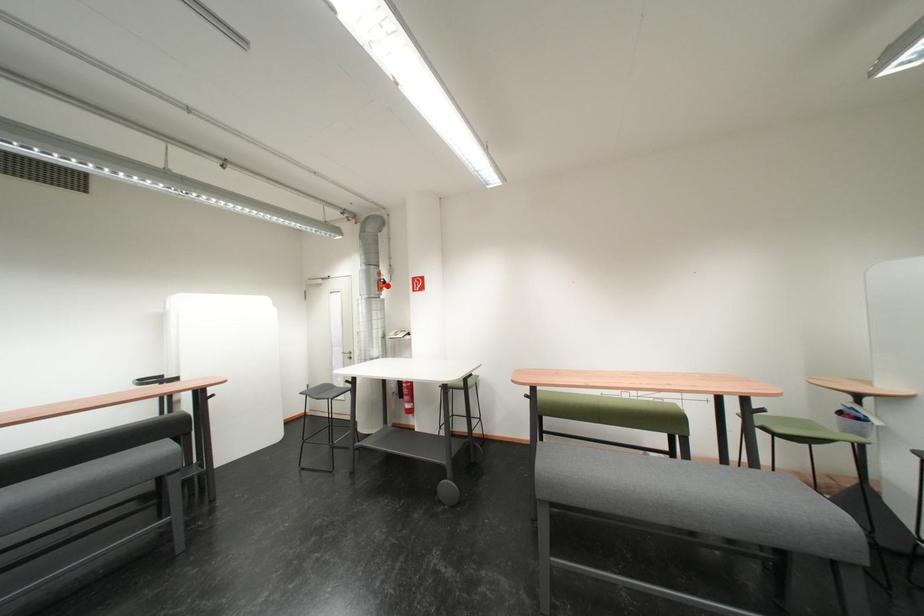
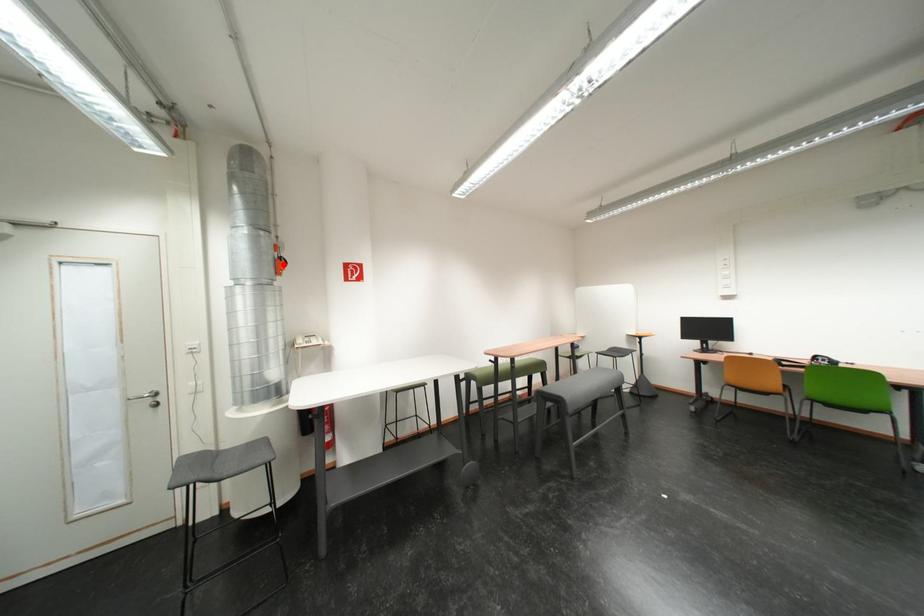
I am providing you with two images of the same scene from different viewpoints. A red point is marked on the first image and another point is marked on the second image. Do the highlighted points in image1 and image2 indicate the same real-world spot?

Yes